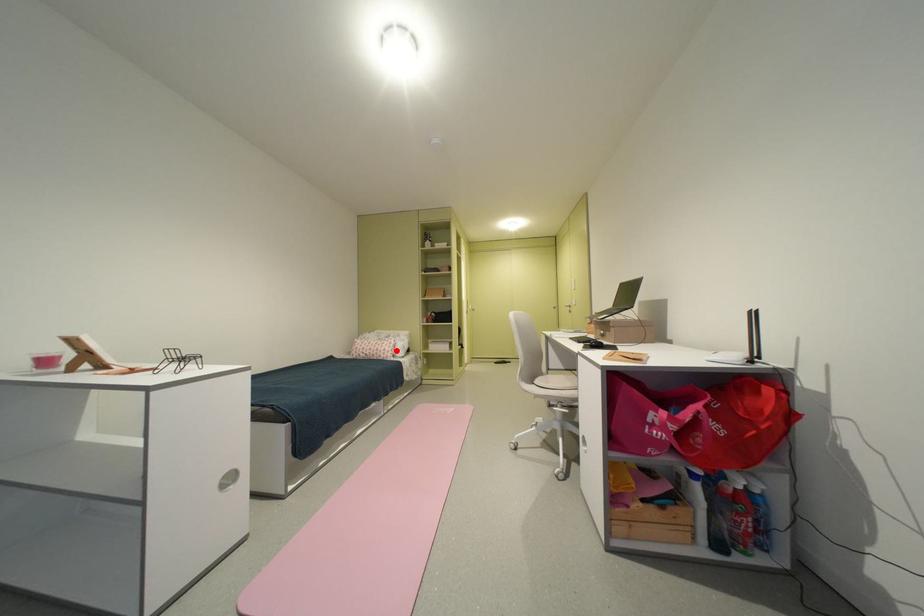
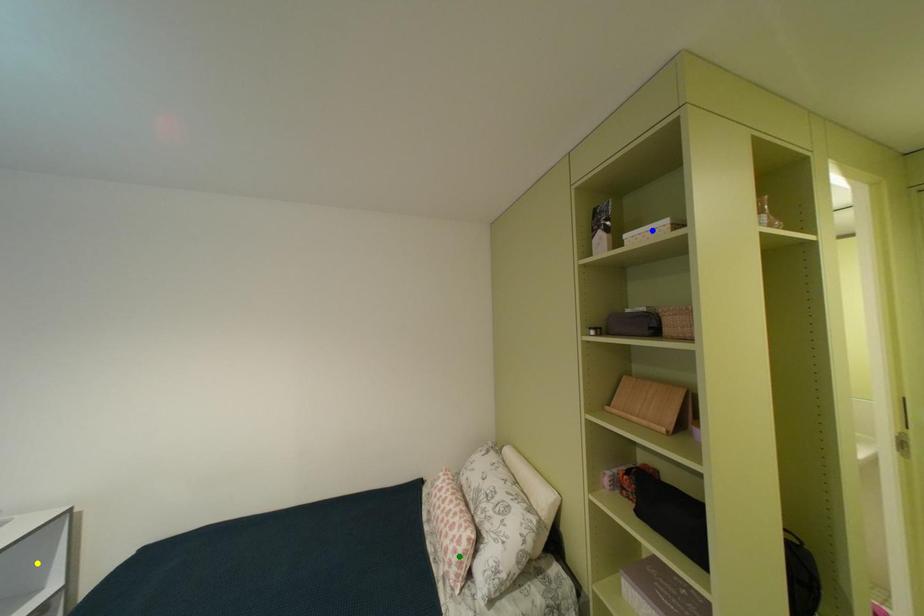
Question: I am providing you with two images of the same scene from different viewpoints. A red point is marked on the first image. You are given multiple points on the second image. Which point in image 2 represents the same 3d spot as the red point in image 1?

Choices:
 (A) yellow point
 (B) green point
 (C) blue point

Answer: (B)